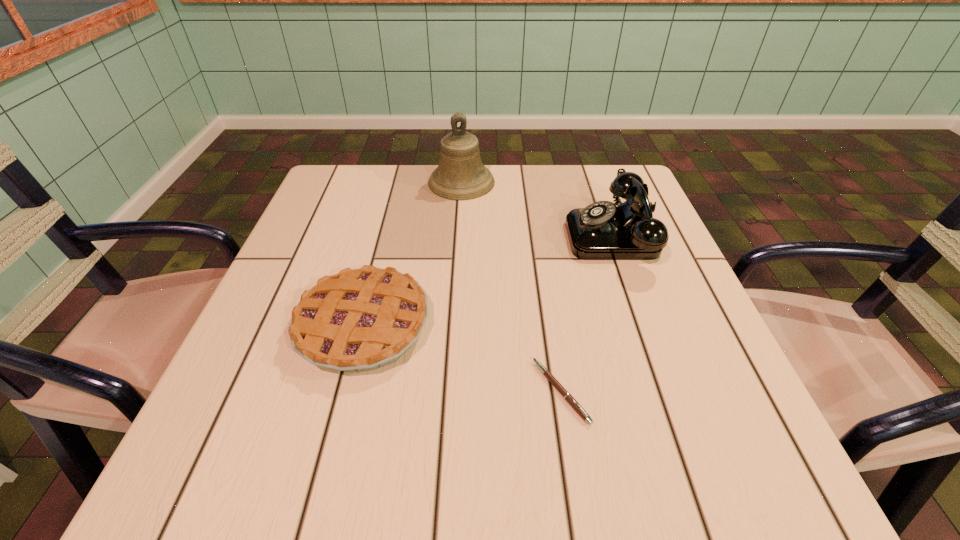
Where is `the farthest object`? The height and width of the screenshot is (540, 960). the farthest object is located at coordinates (460, 175).

Identify the location of the tallest object. (460, 175).

Find the location of a particular element. The width and height of the screenshot is (960, 540). the rightmost object is located at coordinates (603, 230).

You are a GUI agent. You are given a task and a screenshot of the screen. Output one action in this format:
    pyautogui.click(x=<x>, y=<y>)
    Task: Click on the telephone
    The image size is (960, 540).
    Given the screenshot: What is the action you would take?
    pyautogui.click(x=603, y=230)

This screenshot has height=540, width=960. I want to click on pie, so click(x=362, y=319).

Locate an element on the screen. The image size is (960, 540). the third object from left to right is located at coordinates (568, 397).

Locate an element on the screen. the shortest object is located at coordinates (568, 397).

The height and width of the screenshot is (540, 960). What are the coordinates of `free space located 0.110m on the right of the tallest object` in the screenshot? It's located at (537, 183).

You are a GUI agent. You are given a task and a screenshot of the screen. Output one action in this format:
    pyautogui.click(x=<x>, y=<y>)
    Task: Click on the free region located on the dial of the third shortest object
    The height and width of the screenshot is (540, 960).
    Given the screenshot: What is the action you would take?
    pyautogui.click(x=467, y=235)

You are a GUI agent. You are given a task and a screenshot of the screen. Output one action in this format:
    pyautogui.click(x=<x>, y=<y>)
    Task: Click on the vacant space positioned 0.270m on the dial of the third shortest object
    
    Given the screenshot: What is the action you would take?
    tap(448, 235)